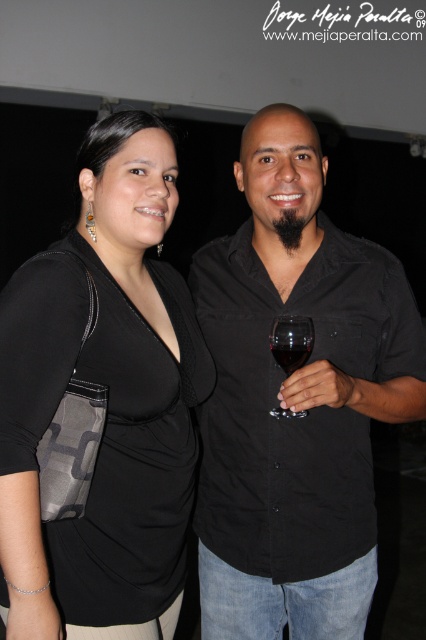
Who is shorter, black matte shirt at center or transparent glass at right?

transparent glass at right is shorter.

Who is positioned more to the left, black matte shirt at center or transparent glass at right?

transparent glass at right

Does point (354, 413) come closer to viewer compared to point (290, 324)?

No.

At what (x,y) coordinates should I click in order to perform the action: click on black matte shirt at center. Please return your answer as a coordinate pair (x, y). The width and height of the screenshot is (426, 640). Looking at the image, I should click on pyautogui.click(x=296, y=400).

Is black matte shirt at center to the right of translucent glass at center from the viewer's perspective?

Correct, you'll find black matte shirt at center to the right of translucent glass at center.

Measure the distance between black matte shirt at center and translucent glass at center.

They are 14.23 inches apart.

Where is `black matte shirt at center`? black matte shirt at center is located at coordinates (296, 400).

Where is `black matte shirt at center`? This screenshot has width=426, height=640. black matte shirt at center is located at coordinates (296, 400).

Describe the element at coordinates (290, 340) in the screenshot. I see `transparent glass at right` at that location.

Does transparent glass at right have a smaller size compared to translucent glass at center?

Incorrect, transparent glass at right is not smaller in size than translucent glass at center.

The height and width of the screenshot is (640, 426). Find the location of `transparent glass at right`. transparent glass at right is located at coordinates (290, 340).